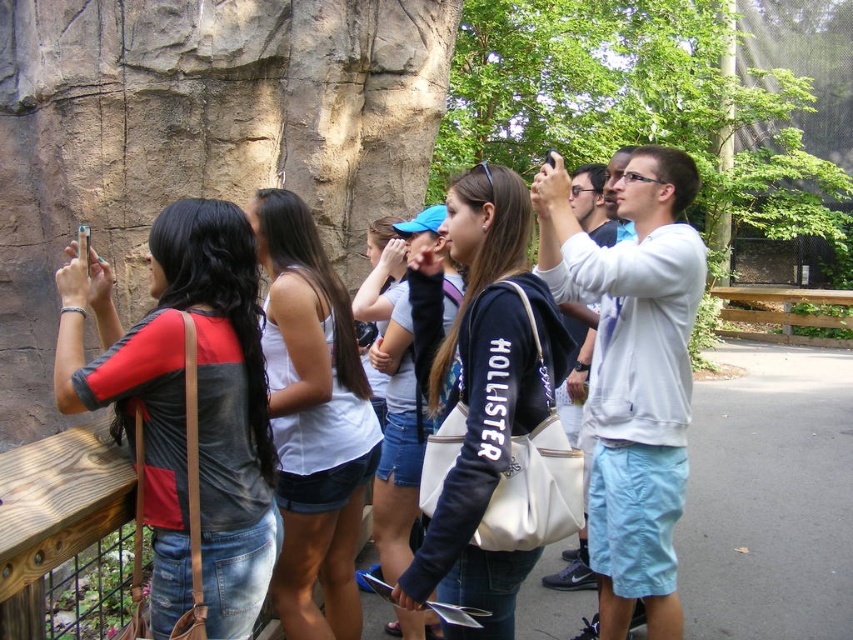
Looking at this image, you are a photographer trying to capture a candid shot of the matte black shirt at left and the white cotton hoodie at upper right. Which person should you focus on first if you want to capture them both in the same frame?

You should focus on the matte black shirt at left first because it is positioned to the left of the white cotton hoodie at upper right, so capturing them both in the same frame would require starting with the one on the left side.

You are a photographer trying to capture a candid shot of the group. You notice the white matte tank top at center and denim shorts at center. Which clothing item is positioned to the left when focusing on the center of the group?

The white matte tank top at center is positioned on the left side of denim shorts at center, so the white matte tank top at center is to the left when focusing on the center of the group.